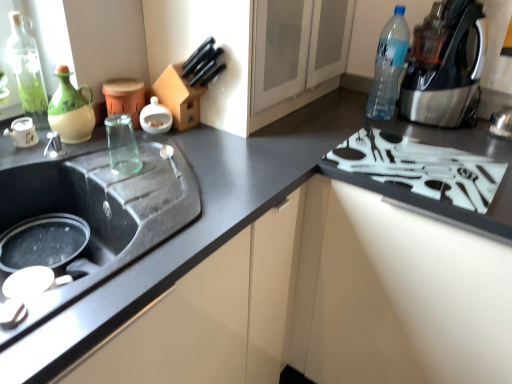
You are a GUI agent. You are given a task and a screenshot of the screen. Output one action in this format:
    pyautogui.click(x=<x>, y=<y>)
    Task: Click on the free space in front of blue plastic bottle at upper right, placed as the 2th bottle when sorted from left to right
    The height and width of the screenshot is (384, 512).
    Given the screenshot: What is the action you would take?
    pyautogui.click(x=405, y=131)